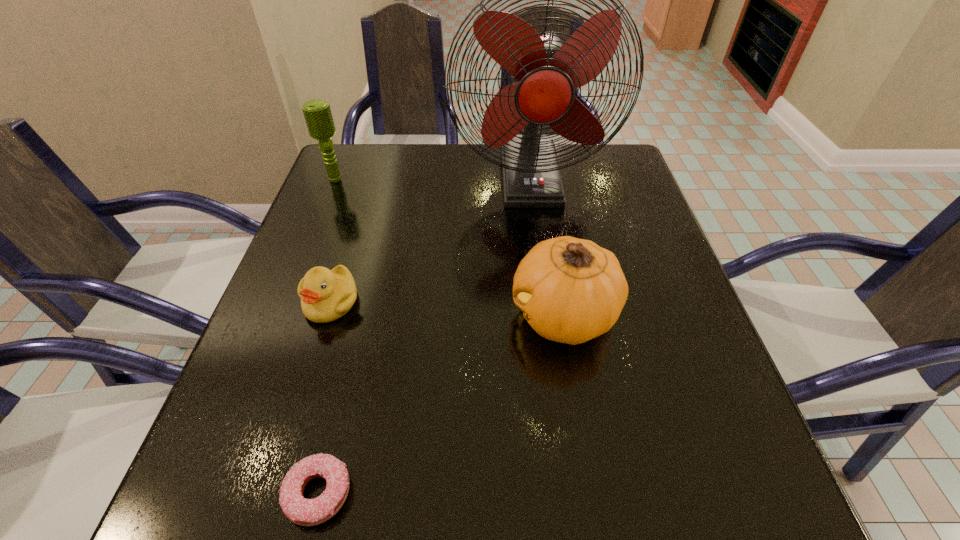
Where is `vacant space located 0.220m on the front face of the pumpkin`? The image size is (960, 540). vacant space located 0.220m on the front face of the pumpkin is located at coordinates (394, 315).

What are the coordinates of `vacant space located 0.280m on the front-facing side of the duckling` in the screenshot? It's located at (275, 484).

Find the location of a particular element. The width and height of the screenshot is (960, 540). free space located 0.100m on the left of the nearest object is located at coordinates (213, 492).

Where is `fan located in the far edge section of the desktop`? fan located in the far edge section of the desktop is located at coordinates (544, 73).

The width and height of the screenshot is (960, 540). I want to click on microphone positioned at the far edge, so click(x=317, y=113).

At what (x,y) coordinates should I click in order to perform the action: click on object that is at the near edge. Please return your answer as a coordinate pair (x, y). The height and width of the screenshot is (540, 960). Looking at the image, I should click on click(x=306, y=512).

The image size is (960, 540). Identify the location of microphone at the left edge. (317, 113).

Locate an element on the screen. duckling that is at the left edge is located at coordinates (326, 295).

Where is `doughnut present at the left edge`? Image resolution: width=960 pixels, height=540 pixels. doughnut present at the left edge is located at coordinates (306, 512).

Where is `fan present at the right edge`? fan present at the right edge is located at coordinates (544, 73).